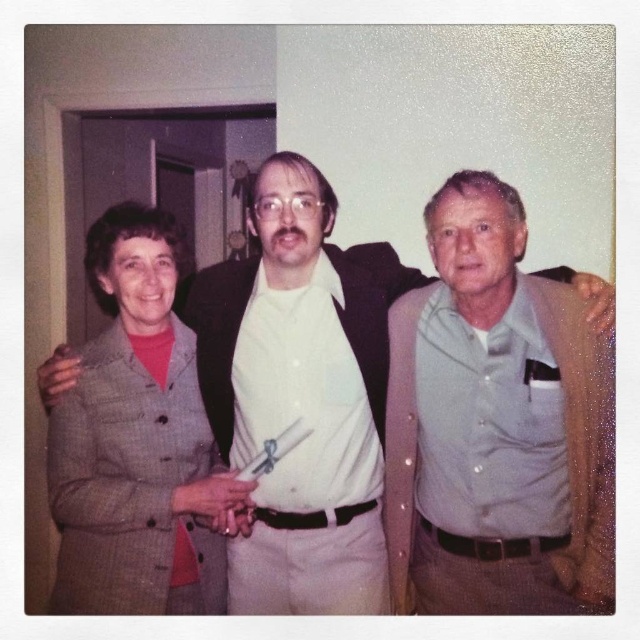
Question: Which of the following is the farthest from the observer?

Choices:
 (A) (225, 304)
 (B) (483, 182)
 (C) (170, 232)

Answer: (A)

Question: Which point is farther to the camera?

Choices:
 (A) gray wool suit at center
 (B) gray woolen suit at left

Answer: (B)

Question: Is gray wool suit at center to the left of gray cotton shirt at center from the viewer's perspective?

Choices:
 (A) yes
 (B) no

Answer: (A)

Question: From the image, what is the correct spatial relationship of gray wool suit at center in relation to gray cotton shirt at center?

Choices:
 (A) left
 (B) right

Answer: (A)

Question: Which point is closer to the camera?

Choices:
 (A) (99, 554)
 (B) (202, 282)
 (C) (444, 433)

Answer: (A)

Question: Does gray wool suit at center appear on the right side of gray cotton shirt at center?

Choices:
 (A) yes
 (B) no

Answer: (B)